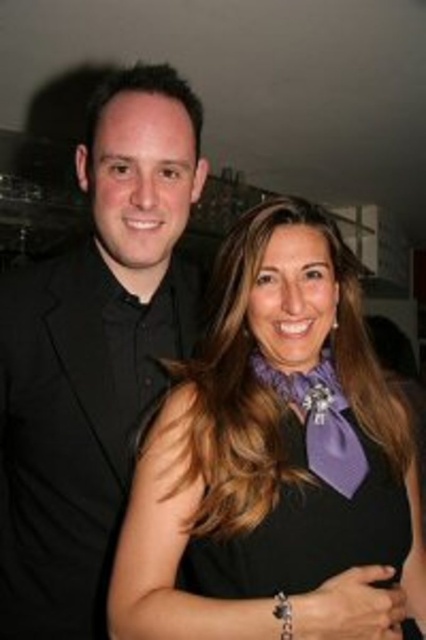
You are a photographer adjusting your camera settings to capture the two subjects in the image. You want to ensure that both the purple satin scarf at center and the black matte suit at left are clearly visible in the final shot. Based on their positions, which object should you focus on first to ensure proper exposure?

The purple satin scarf at center is below the black matte suit at left, so focusing on the black matte suit at left first will help ensure proper exposure since it is positioned higher and might be in a different light zone compared to the lower scarf.

You are a photographer adjusting the camera settings to capture a clear photo of both the purple satin scarf at center and the purple satin tie at center. Given that the camera has a depth of field that can focus on objects within a 4 inch range, will both items be in focus simultaneously?

The purple satin scarf at center is 4.51 inches away from the purple satin tie at center. Since the distance between them exceeds the camera sensor depth of field range of 4 inches, they cannot both be in focus at the same time.

You are a photographer at an event and notice two purple accessories at center. The purple satin dress at center is worn by a person on the left, and the purple satin tie at center is worn by the person on the right. Which accessory is closer to the left side of the image?

The purple satin dress at center is positioned on the left side of the purple satin tie at center, so the purple satin dress at center is closer to the left side of the image.